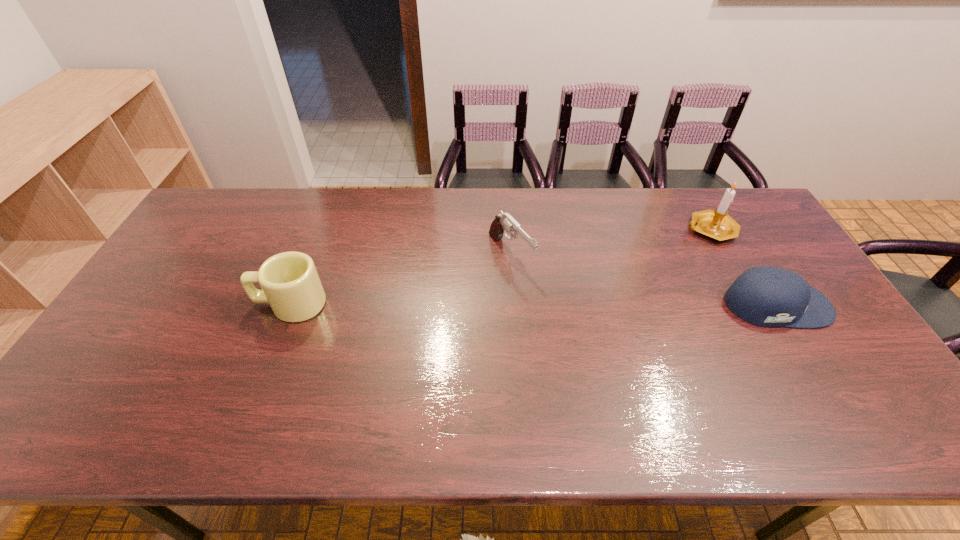
You are a GUI agent. You are given a task and a screenshot of the screen. Output one action in this format:
    pyautogui.click(x=<x>, y=<y>)
    Task: Click on the vacant region at the far left corner of the desktop
    The width and height of the screenshot is (960, 540).
    Given the screenshot: What is the action you would take?
    pyautogui.click(x=228, y=205)

In the image, there is a desktop. Identify the location of vacant space at the far right corner. (767, 230).

Image resolution: width=960 pixels, height=540 pixels. Find the location of `free space between the second object from left to right and the leftmost object`. free space between the second object from left to right and the leftmost object is located at coordinates pyautogui.click(x=400, y=279).

I want to click on blank region between the tallest object and the mug, so click(500, 267).

Where is `free area in between the baseball cap and the gun`? Image resolution: width=960 pixels, height=540 pixels. free area in between the baseball cap and the gun is located at coordinates (643, 279).

At what (x,y) coordinates should I click in order to perform the action: click on free space between the mug and the tallest object. Please return your answer as a coordinate pair (x, y). Looking at the image, I should click on (500, 267).

This screenshot has height=540, width=960. Identify the location of free point between the gun and the mug. (400, 279).

This screenshot has width=960, height=540. In order to click on free space that is in between the second object from left to right and the leftmost object in this screenshot , I will do `click(400, 279)`.

You are a GUI agent. You are given a task and a screenshot of the screen. Output one action in this format:
    pyautogui.click(x=<x>, y=<y>)
    Task: Click on the free space between the shortest object and the mug
    Image resolution: width=960 pixels, height=540 pixels.
    Given the screenshot: What is the action you would take?
    pos(534,305)

You are a GUI agent. You are given a task and a screenshot of the screen. Output one action in this format:
    pyautogui.click(x=<x>, y=<y>)
    Task: Click on the empty space between the third object from right to left and the leftmost object
    The width and height of the screenshot is (960, 540).
    Given the screenshot: What is the action you would take?
    pyautogui.click(x=400, y=279)